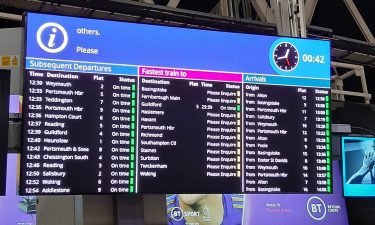
The image size is (375, 225). I want to click on metal supports, so click(x=363, y=28), click(x=296, y=27).